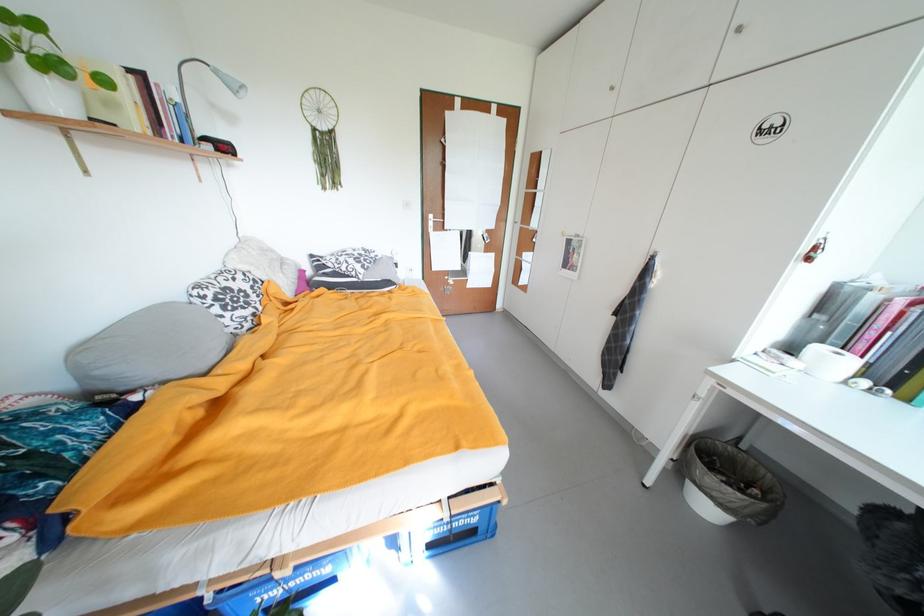
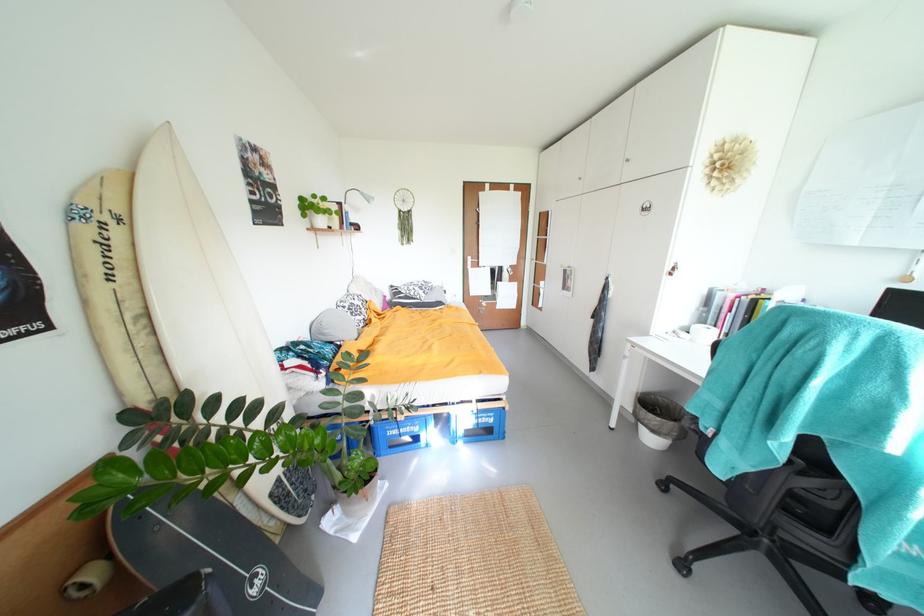
Find the pixel in the second image that matches the point at 444,232 in the first image.

(480, 268)